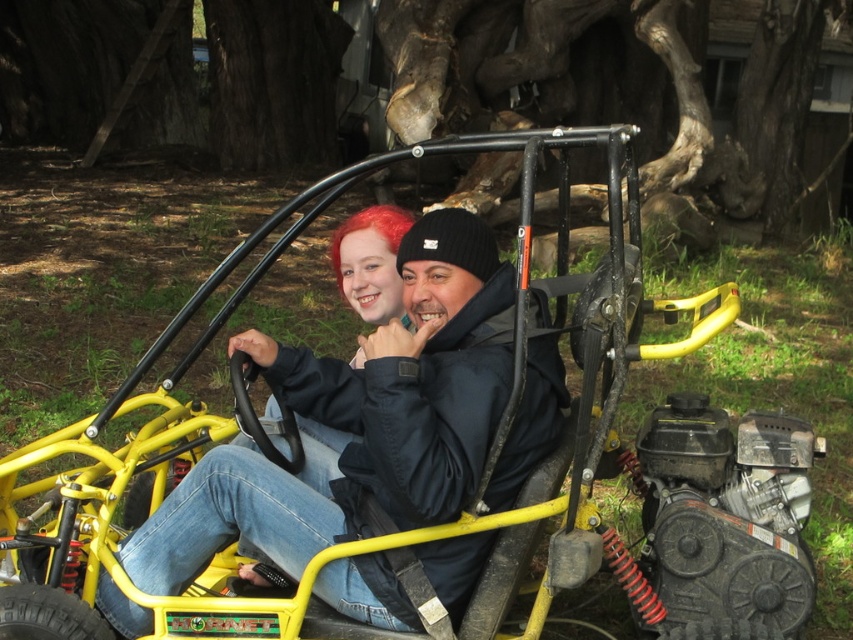
You are a photographer trying to capture a clear photo of both the matte black jacket at center and the vivid red hair at center. Since you want both subjects to be in focus, which one should you focus on first to ensure the other is also sharp?

You should focus on the matte black jacket at center first because it is closer to the camera than the vivid red hair at center, ensuring both will be in focus when using depth of field properly.

Consider the image. You are a photographer positioned to the front of the go kart. You want to take a photo that includes both the matte black jacket at center and the vivid red hair at center. Which object should you focus on first to ensure both are in frame?

The matte black jacket at center is in front of the vivid red hair at center, so you should focus on the matte black jacket at center first to ensure both are in frame.

You are a photographer trying to capture a closeup shot of the two people in the go kart. You have a camera with a lens that can focus on objects up to 2 meters away. The distance from your current position to the matte black jacket at center is 1.8 meters. Can you also capture the vivid red hair at center in the same shot without moving the camera?

The matte black jacket at center is wider than the vivid red hair at center. Since the distance to the jacket is within the camera lens range, and the hair is likely closer or within the same focal plane, the vivid red hair at center can be captured in the same shot without moving the camera.